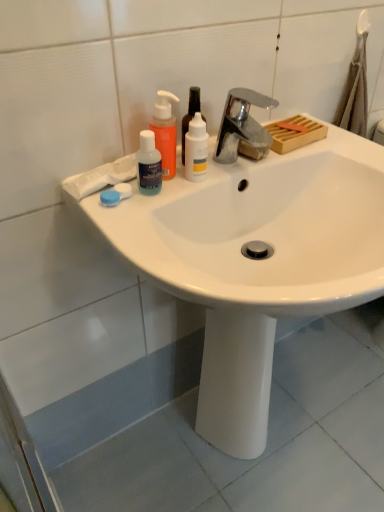
Question: Considering the relative positions of chrome metallic faucet at upper center and blue plastic contact lens case at left in the image provided, is chrome metallic faucet at upper center in front of blue plastic contact lens case at left?

Choices:
 (A) no
 (B) yes

Answer: (B)

Question: From the image's perspective, does chrome metallic faucet at upper center appear higher than blue plastic contact lens case at left?

Choices:
 (A) no
 (B) yes

Answer: (B)

Question: Is chrome metallic faucet at upper center next to blue plastic contact lens case at left and touching it?

Choices:
 (A) yes
 (B) no

Answer: (B)

Question: From a real-world perspective, does chrome metallic faucet at upper center sit lower than blue plastic contact lens case at left?

Choices:
 (A) yes
 (B) no

Answer: (B)

Question: Can you confirm if chrome metallic faucet at upper center is positioned to the right of blue plastic contact lens case at left?

Choices:
 (A) yes
 (B) no

Answer: (A)

Question: Choose the correct answer: Is translucent plastic mouthwash at upper left, positioned as the 3th mouthwash in right-to-left order, inside blue plastic contact lens case at left or outside it?

Choices:
 (A) outside
 (B) inside

Answer: (A)

Question: From a real-world perspective, is translucent plastic mouthwash at upper left, positioned as the 3th mouthwash in right-to-left order, above or below blue plastic contact lens case at left?

Choices:
 (A) below
 (B) above

Answer: (B)

Question: Based on their sizes in the image, would you say translucent plastic mouthwash at upper left, positioned as the 3th mouthwash in right-to-left order, is bigger or smaller than blue plastic contact lens case at left?

Choices:
 (A) small
 (B) big

Answer: (B)

Question: Relative to blue plastic contact lens case at left, is translucent plastic mouthwash at upper left, positioned as the 3th mouthwash in right-to-left order, in front or behind?

Choices:
 (A) front
 (B) behind

Answer: (A)

Question: Is point (200, 98) positioned closer to the camera than point (213, 382)?

Choices:
 (A) farther
 (B) closer

Answer: (B)

Question: Looking at their shapes, would you say white glossy bottle at center, the second mouthwash when ordered from right to left, is wider or thinner than white glossy sink at center?

Choices:
 (A) wide
 (B) thin

Answer: (B)

Question: Choose the correct answer: Is white glossy bottle at center, the second mouthwash when ordered from right to left, inside white glossy sink at center or outside it?

Choices:
 (A) outside
 (B) inside

Answer: (A)

Question: From their relative heights in the image, would you say white glossy bottle at center, marked as the 2th mouthwash in a left-to-right arrangement, is taller or shorter than white glossy sink at center?

Choices:
 (A) tall
 (B) short

Answer: (B)

Question: Considering the positions of translucent orange pump bottle at upper left and white glossy bottle at center, the third mouthwash in the left-to-right sequence, in the image, is translucent orange pump bottle at upper left taller or shorter than white glossy bottle at center, the third mouthwash in the left-to-right sequence,?

Choices:
 (A) short
 (B) tall

Answer: (B)

Question: Would you say translucent orange pump bottle at upper left is inside or outside white glossy bottle at center, the third mouthwash in the left-to-right sequence?

Choices:
 (A) outside
 (B) inside

Answer: (A)